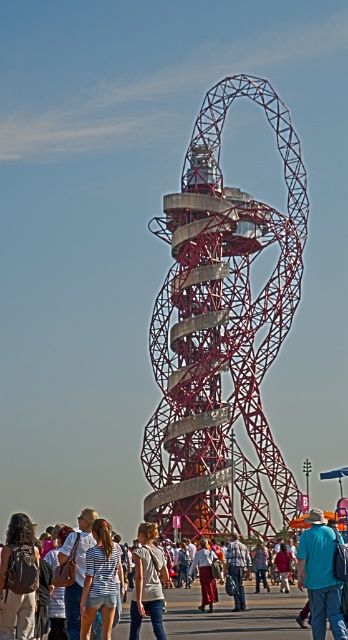
Is metallic red sculpture at center positioned behind striped cotton shirt at center?

Yes, metallic red sculpture at center is behind striped cotton shirt at center.

Which is more to the right, metallic red sculpture at center or striped cotton shirt at center?

metallic red sculpture at center is more to the right.

Is point (285, 148) closer to viewer compared to point (85, 625)?

No.

The width and height of the screenshot is (348, 640). I want to click on metallic red sculpture at center, so (x=222, y=330).

Who is more forward, (x=106, y=552) or (x=208, y=588)?

Point (x=106, y=552) is in front.

Consider the image. Is striped cotton shirt at center positioned behind denim shorts at center?

No.

This screenshot has height=640, width=348. What are the coordinates of `striped cotton shirt at center` in the screenshot? It's located at (99, 580).

The width and height of the screenshot is (348, 640). In order to click on striped cotton shirt at center in this screenshot , I will do `click(99, 580)`.

Is dark brown backpack at lower left shorter than striped cotton shirt at center?

In fact, dark brown backpack at lower left may be taller than striped cotton shirt at center.

Identify the location of dark brown backpack at lower left. The image size is (348, 640). (19, 579).

Between point (14, 598) and point (98, 589), which one is positioned in front?

Point (98, 589)

The image size is (348, 640). In order to click on dark brown backpack at lower left in this screenshot , I will do `click(19, 579)`.